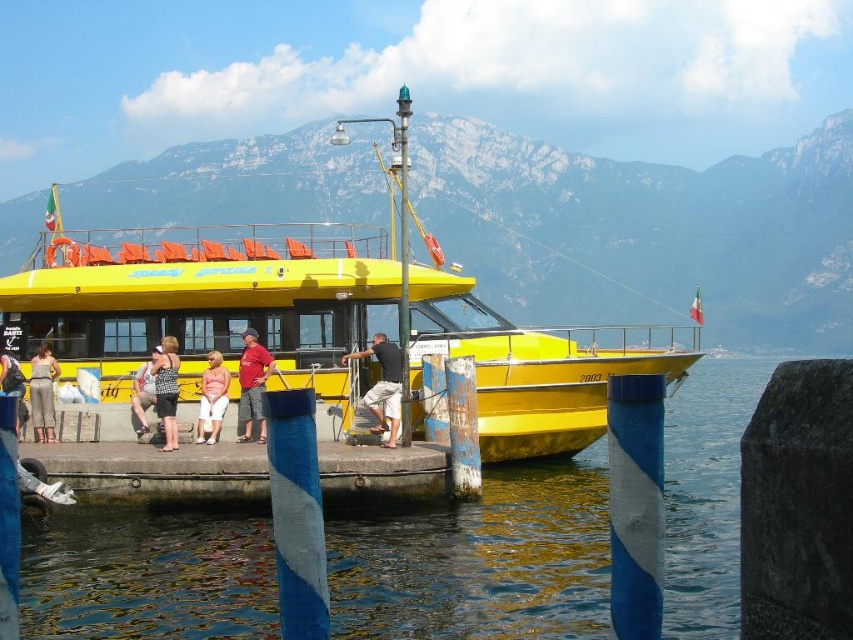
Question: Is the position of red cotton shirt at center more distant than that of matte pink shirt at center?

Choices:
 (A) no
 (B) yes

Answer: (A)

Question: Which object is the closest to the matte black tank top at left?

Choices:
 (A) black cotton shirt at center
 (B) matte black dress at lower left

Answer: (B)

Question: Is clear blue water at lower center to the right of black cotton shirt at center from the viewer's perspective?

Choices:
 (A) no
 (B) yes

Answer: (B)

Question: Is yellow matte boat at center behind concrete dock at lower center?

Choices:
 (A) no
 (B) yes

Answer: (B)

Question: Which of the following is the farthest from the observer?

Choices:
 (A) (33, 416)
 (B) (398, 419)
 (C) (267, 248)

Answer: (C)

Question: Which point is closer to the camera?

Choices:
 (A) clear blue water at lower center
 (B) denim pants at left
 (C) matte black tank top at left

Answer: (A)